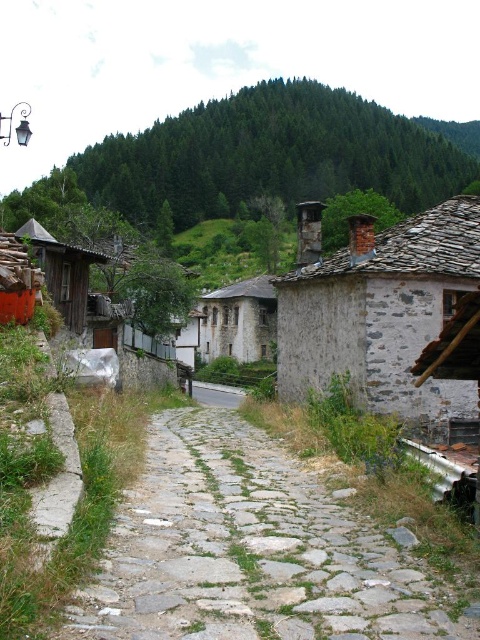
You are standing at the entrance of the village and want to reach the gray stone path at center. According to the map coordinates, which point should you head towards?

You should head towards point (249,550) to reach the gray stone path at center.

You are a delivery person carrying a heavy package and need to walk along the gray stone path at center and the gray cobblestone alley at center. Which path should you choose to avoid slipping?

The gray stone path at center is above the gray cobblestone alley at center, so it has better stability and is less likely to cause slipping. Choose the gray stone path at center.

You are standing at the starting point of the cobblestone path in the village. You see two points marked on the path. One is labeled as point [226,515] and the other is point [239,388]. If you walk along the path towards the village center, which point will you encounter first?

Point [226,515] is in front of point [239,388], so you will encounter point [226,515] first as you walk towards the village center.